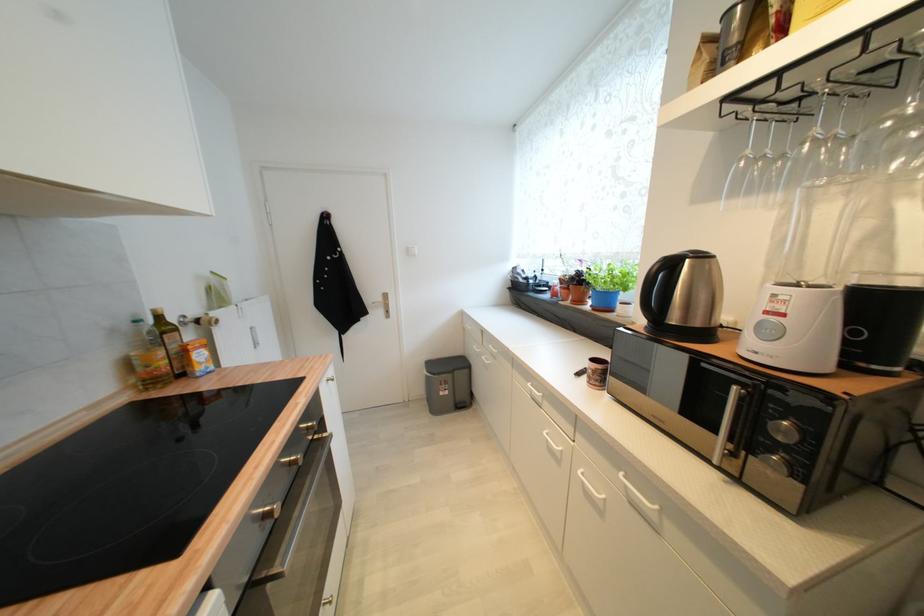
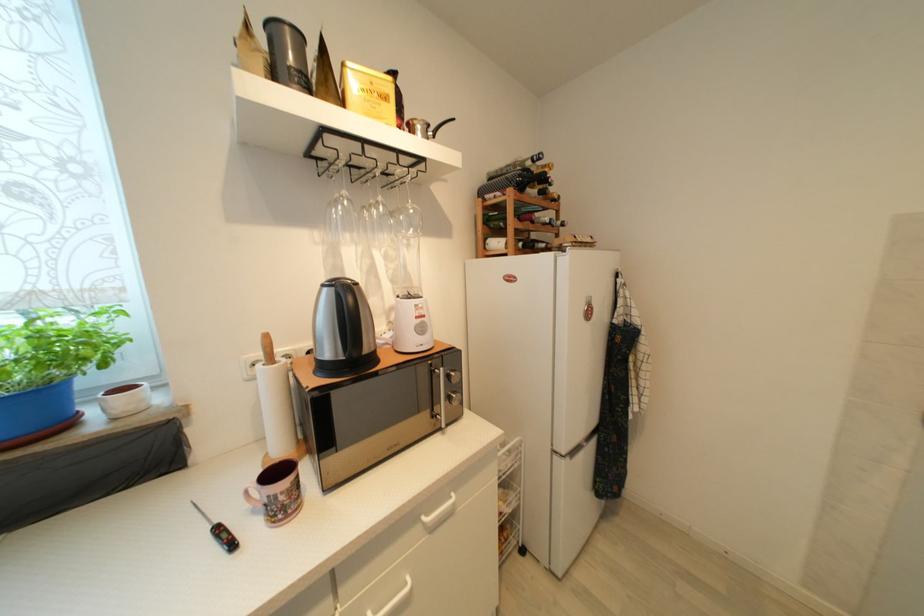
Where in the second image is the point corresponding to point 627,476 from the first image?

(429, 521)